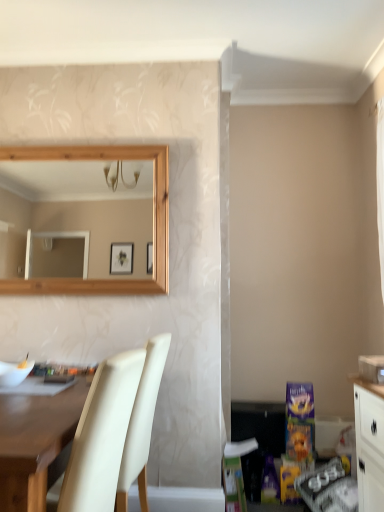
Locate an element on the screen. The width and height of the screenshot is (384, 512). matte white desk at lower left is located at coordinates (36, 444).

This screenshot has width=384, height=512. What do you see at coordinates (36, 444) in the screenshot?
I see `matte white desk at lower left` at bounding box center [36, 444].

What is the approximate width of matte white desk at lower left?

The width of matte white desk at lower left is 1.42 meters.

Identify the location of cream leather chair at lower left. The width and height of the screenshot is (384, 512). (140, 423).

What do you see at coordinates (140, 423) in the screenshot? The height and width of the screenshot is (512, 384). I see `cream leather chair at lower left` at bounding box center [140, 423].

Where is `matte white desk at lower left`? The width and height of the screenshot is (384, 512). matte white desk at lower left is located at coordinates (36, 444).

In the scene shown: Considering the positions of objects cream leather chair at lower left and matte white desk at lower left in the image provided, who is more to the right, cream leather chair at lower left or matte white desk at lower left?

cream leather chair at lower left is more to the right.

Is cream leather chair at lower left positioned behind matte white desk at lower left?

Yes, cream leather chair at lower left is further from the camera.

Which is behind, point (125, 486) or point (60, 464)?

The point (125, 486) is behind.

From the picture: From the image's perspective, between cream leather chair at lower left and matte white desk at lower left, who is located below?

matte white desk at lower left is shown below in the image.

From a real-world perspective, which object stands above the other?

From a 3D spatial view, cream leather chair at lower left is above.

Considering the sizes of cream leather chair at lower left and matte white desk at lower left in the image, is cream leather chair at lower left wider or thinner than matte white desk at lower left?

cream leather chair at lower left is thinner than matte white desk at lower left.

Does cream leather chair at lower left have a greater height compared to matte white desk at lower left?

Yes.

Is cream leather chair at lower left bigger than matte white desk at lower left?

No.

Would you say cream leather chair at lower left is outside matte white desk at lower left?

A: Actually, cream leather chair at lower left is within matte white desk at lower left.

Based on the photo, does cream leather chair at lower left touch matte white desk at lower left?

cream leather chair at lower left and matte white desk at lower left are clearly separated.

Is cream leather chair at lower left turned away from matte white desk at lower left?

Yes, cream leather chair at lower left's orientation is away from matte white desk at lower left.

This screenshot has width=384, height=512. In order to click on desk below the cream leather chair at lower left (from the image's perspective) in this screenshot , I will do `click(36, 444)`.

Can you confirm if matte white desk at lower left is positioned to the left of cream leather chair at lower left?

Indeed, matte white desk at lower left is positioned on the left side of cream leather chair at lower left.

Is matte white desk at lower left closer to the viewer compared to cream leather chair at lower left?

Yes, it is in front of cream leather chair at lower left.

Is point (39, 444) closer or farther from the camera than point (142, 423)?

Point (39, 444) is closer to the camera than point (142, 423).

From the image's perspective, is matte white desk at lower left beneath cream leather chair at lower left?

Yes.

Looking at this image, from a real-world perspective, is matte white desk at lower left above or below cream leather chair at lower left?

matte white desk at lower left is situated lower than cream leather chair at lower left in the real world.

Considering the sizes of matte white desk at lower left and cream leather chair at lower left in the image, is matte white desk at lower left wider or thinner than cream leather chair at lower left?

In the image, matte white desk at lower left appears to be wider than cream leather chair at lower left.

From their relative heights in the image, would you say matte white desk at lower left is taller or shorter than cream leather chair at lower left?

In the image, matte white desk at lower left appears to be shorter than cream leather chair at lower left.

Based on their sizes in the image, would you say matte white desk at lower left is bigger or smaller than cream leather chair at lower left?

Considering their sizes, matte white desk at lower left takes up more space than cream leather chair at lower left.

Is matte white desk at lower left surrounding cream leather chair at lower left?

Yes, matte white desk at lower left is surrounding cream leather chair at lower left.

Based on the photo, is there a large distance between matte white desk at lower left and cream leather chair at lower left?

That's not correct — matte white desk at lower left is a little close to cream leather chair at lower left.

Is matte white desk at lower left looking in the opposite direction of cream leather chair at lower left?

Absolutely, matte white desk at lower left is directed away from cream leather chair at lower left.

What's the angular difference between matte white desk at lower left and cream leather chair at lower left's facing directions?

The facing directions of matte white desk at lower left and cream leather chair at lower left are 94 degrees apart.

How far apart are matte white desk at lower left and cream leather chair at lower left?

They are 10.79 inches apart.

Locate an element on the screen. Image resolution: width=384 pixels, height=512 pixels. desk lying in front of the cream leather chair at lower left is located at coordinates (36, 444).

Locate an element on the screen. The width and height of the screenshot is (384, 512). chair that is on the right side of matte white desk at lower left is located at coordinates (140, 423).

There is a matte white desk at lower left. Where is `chair above it (from a real-world perspective)`? chair above it (from a real-world perspective) is located at coordinates (140, 423).